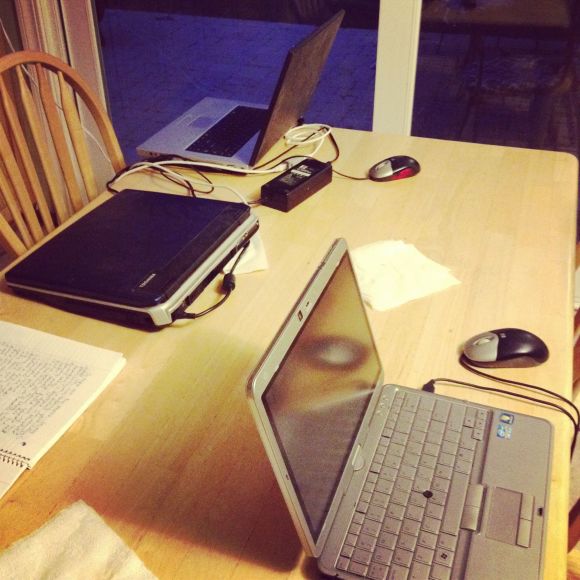
Where is `trackpad`? trackpad is located at coordinates (509, 509), (201, 122).